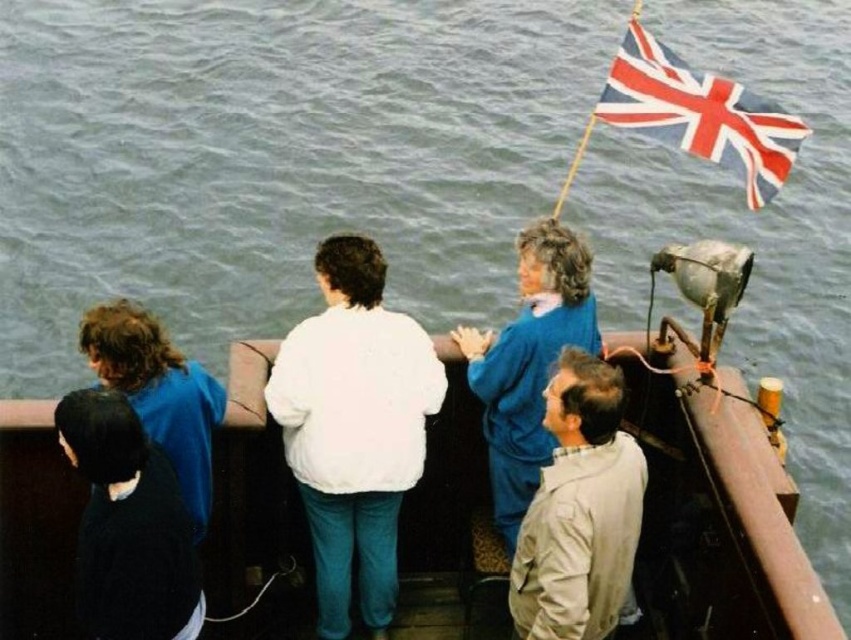
You are on the deck of a boat and want to move from the point closer to the camera to the point farther away. Which direction should you move? The two points are located at point [369,369] and point [203,493].

You should move towards the direction of point [203,493] because it is farther from the camera compared to point [369,369].

You are a photographer on a boat deck. You want to take a photo of the light beige fabric jacket at lower right and the black matte jacket at lower left. The minimum distance required for your camera to focus both subjects clearly is 10 feet. Can you capture both subjects in focus without moving the camera?

The distance between the light beige fabric jacket at lower right and the black matte jacket at lower left is 11.62 feet, which exceeds the camera minimum focus distance of 10 feet. Therefore, the camera can focus both subjects clearly without moving.

You are a photographer on the boat deck and want to take a photo of both the light beige fabric jacket at lower right and the black matte jacket at lower left. Which jacket will appear closer to the camera in the photo?

The light beige fabric jacket at lower right will appear closer to the camera in the photo because it is further to the viewer than the black matte jacket at lower left.